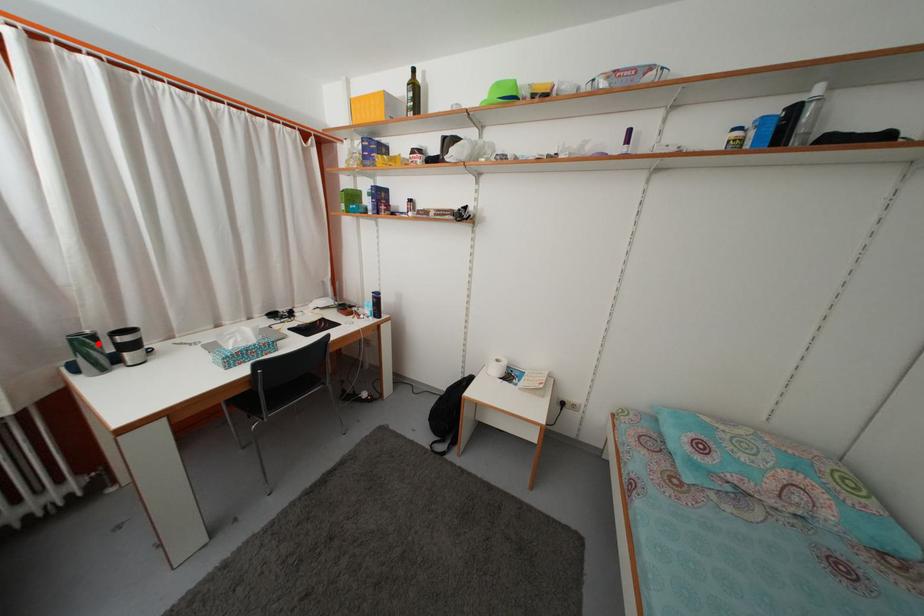
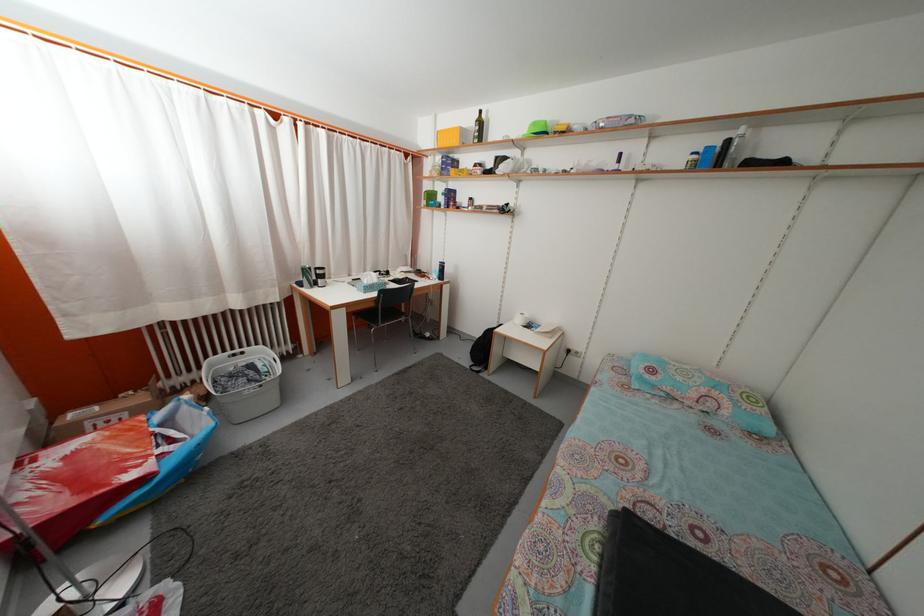
The point at the highlighted location is marked in the first image. Where is the corresponding point in the second image?

(315, 276)